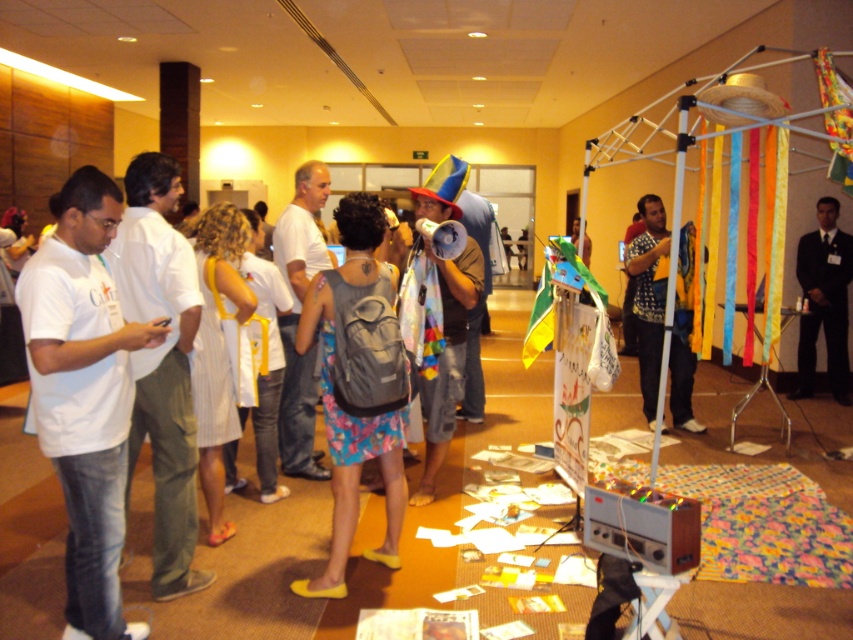
Question: Which point appears closest to the camera in this image?

Choices:
 (A) coord(630,262)
 (B) coord(100,445)

Answer: (B)

Question: Which point is farther to the camera?

Choices:
 (A) white matte t-shirt at left
 (B) patterned fabric at center

Answer: (B)

Question: Estimate the real-world distances between objects in this image. Which object is farther from the black suit at right?

Choices:
 (A) patterned fabric at center
 (B) gray fabric backpack at center
 (C) white matte t-shirt at left

Answer: (C)

Question: Where is gray fabric backpack at center located in relation to patterned fabric at center in the image?

Choices:
 (A) below
 (B) above

Answer: (A)

Question: Does white matte t-shirt at left have a smaller size compared to gray fabric backpack at center?

Choices:
 (A) yes
 (B) no

Answer: (B)

Question: Is gray fabric backpack at center to the left of black suit at right from the viewer's perspective?

Choices:
 (A) no
 (B) yes

Answer: (B)